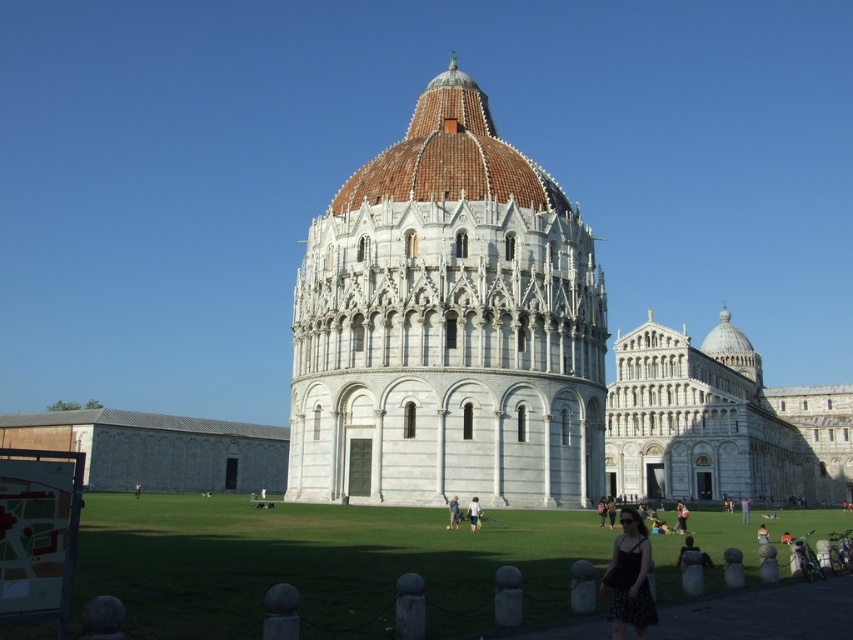
Question: Where is black fabric person at lower center located in relation to light brown leather jacket at center in the image?

Choices:
 (A) below
 (B) above

Answer: (B)

Question: Does white marble cathedral at right have a larger size compared to brown tiled dome at center?

Choices:
 (A) no
 (B) yes

Answer: (B)

Question: Which point is closer to the camera?

Choices:
 (A) (326, 282)
 (B) (602, 504)

Answer: (B)

Question: Which point is closer to the camera taking this photo?

Choices:
 (A) (471, 508)
 (B) (490, 148)
 (C) (601, 518)
 (D) (705, 561)

Answer: (D)

Question: Which of the following is the closest to the observer?

Choices:
 (A) light blue denim shorts at center
 (B) black textured dress at lower right
 (C) brown tiled dome at center
 (D) black fabric at center

Answer: (B)

Question: Is black fabric person at lower center positioned at the back of light blue denim shorts at center?

Choices:
 (A) no
 (B) yes

Answer: (A)